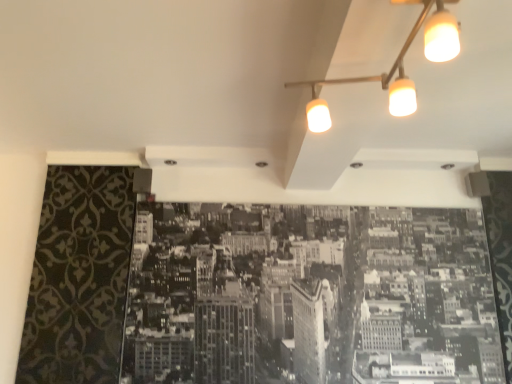
Question: Should I look upward or downward to see matte white track light at upper right?

Choices:
 (A) down
 (B) up

Answer: (B)

Question: Considering the relative sizes of monochrome paper cityscape at center and matte white track light at upper right in the image provided, is monochrome paper cityscape at center smaller than matte white track light at upper right?

Choices:
 (A) no
 (B) yes

Answer: (A)

Question: Does monochrome paper cityscape at center turn towards matte white track light at upper right?

Choices:
 (A) yes
 (B) no

Answer: (A)

Question: Is monochrome paper cityscape at center with matte white track light at upper right?

Choices:
 (A) no
 (B) yes

Answer: (A)

Question: Can you confirm if monochrome paper cityscape at center is positioned to the left of matte white track light at upper right?

Choices:
 (A) no
 (B) yes

Answer: (B)

Question: Can you confirm if monochrome paper cityscape at center is positioned to the right of matte white track light at upper right?

Choices:
 (A) yes
 (B) no

Answer: (B)

Question: From a real-world perspective, is monochrome paper cityscape at center physically above matte white track light at upper right?

Choices:
 (A) yes
 (B) no

Answer: (B)

Question: Is matte white track light at upper right in front of monochrome paper cityscape at center?

Choices:
 (A) yes
 (B) no

Answer: (A)

Question: From a real-world perspective, is matte white track light at upper right over monochrome paper cityscape at center?

Choices:
 (A) no
 (B) yes

Answer: (B)

Question: From the image's perspective, is matte white track light at upper right located above monochrome paper cityscape at center?

Choices:
 (A) no
 (B) yes

Answer: (B)

Question: Is matte white track light at upper right placed right next to monochrome paper cityscape at center?

Choices:
 (A) no
 (B) yes

Answer: (A)

Question: Can you confirm if matte white track light at upper right is positioned to the left of monochrome paper cityscape at center?

Choices:
 (A) no
 (B) yes

Answer: (A)

Question: Would you say matte white track light at upper right is outside monochrome paper cityscape at center?

Choices:
 (A) no
 (B) yes

Answer: (B)

Question: From the image's perspective, is matte white track light at upper right above or below monochrome paper cityscape at center?

Choices:
 (A) above
 (B) below

Answer: (A)